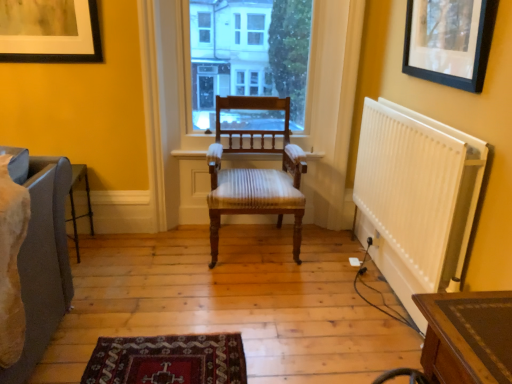
Question: Do you think white plastic radiator at right is within wooden chair at center, or outside of it?

Choices:
 (A) inside
 (B) outside

Answer: (B)

Question: Relative to wooden chair at center, is white plastic radiator at right in front or behind?

Choices:
 (A) behind
 (B) front

Answer: (B)

Question: Considering the real-world distances, which object is farthest from the matte black picture frame at upper left, the second picture frame from the right?

Choices:
 (A) black matte picture frame at upper right, which is the 1th picture frame from front to back
 (B) white plastic radiator at right
 (C) transparent glass window at center
 (D) wooden chair at center

Answer: (A)

Question: Considering the real-world distances, which object is farthest from the wooden chair at center?

Choices:
 (A) black matte picture frame at upper right, the 2th picture frame viewed from the back
 (B) matte black picture frame at upper left, the second picture frame from the right
 (C) white plastic radiator at right
 (D) transparent glass window at center

Answer: (B)